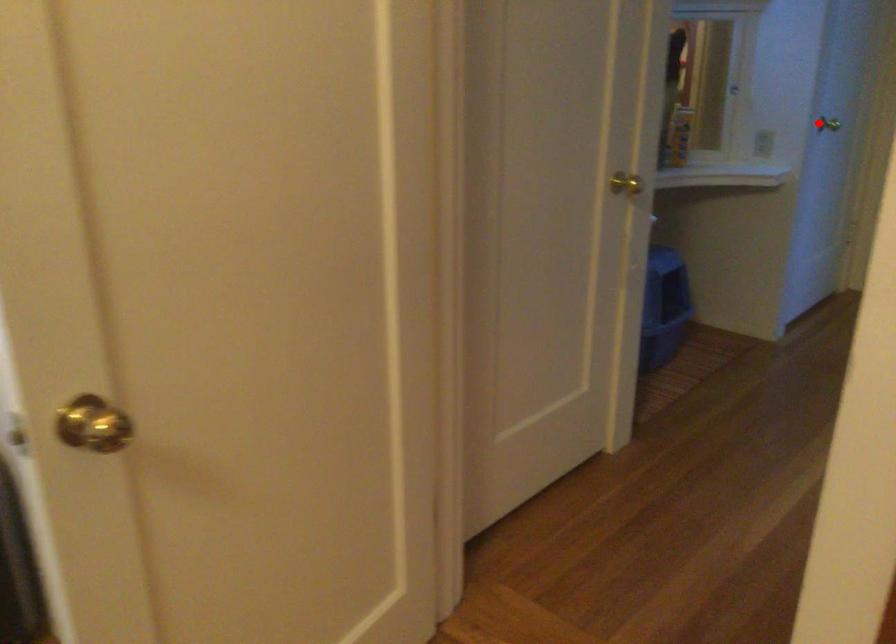
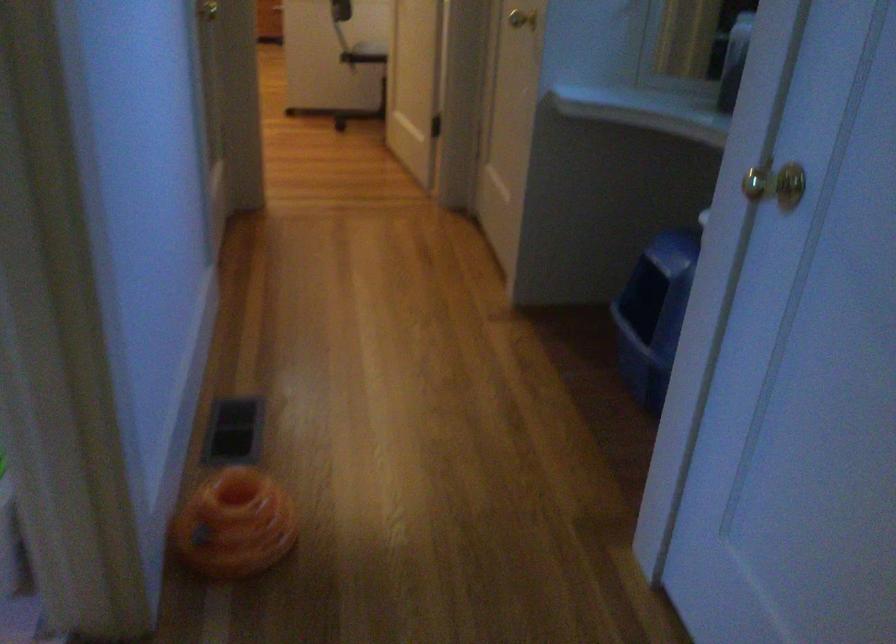
Question: A red point is marked in image1. In image2, is the corresponding 3D point closer to the camera or farther? Reply with the corresponding letter.

Choices:
 (A) The corresponding 3D point is closer.
 (B) The corresponding 3D point is farther.

Answer: (A)